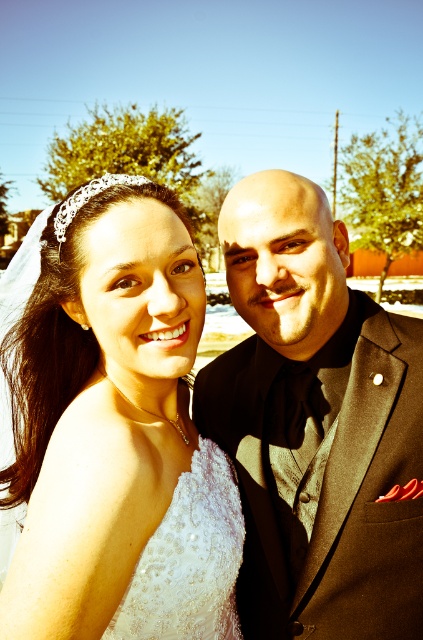
Does point (153, 476) lie behind point (277, 372)?

No, it is not.

Who is taller, white satin dress at center or black satin suit at right?

Standing taller between the two is black satin suit at right.

Does point (109, 488) come behind point (213, 433)?

That is False.

This screenshot has height=640, width=423. I want to click on white satin dress at center, so click(115, 433).

Who is higher up, white satin dress at center or ivory lace dress at center?

white satin dress at center is higher up.

Which is behind, point (74, 243) or point (165, 584)?

Point (74, 243)

Find the location of a particular element. This screenshot has height=640, width=423. white satin dress at center is located at coordinates (115, 433).

Is black satin suit at right taller than ivory lace dress at center?

Correct, black satin suit at right is much taller as ivory lace dress at center.

Is point (414, 512) more distant than point (216, 520)?

That is True.

Which is in front, point (395, 371) or point (198, 577)?

Point (198, 577)

The width and height of the screenshot is (423, 640). I want to click on black satin suit at right, so click(315, 424).